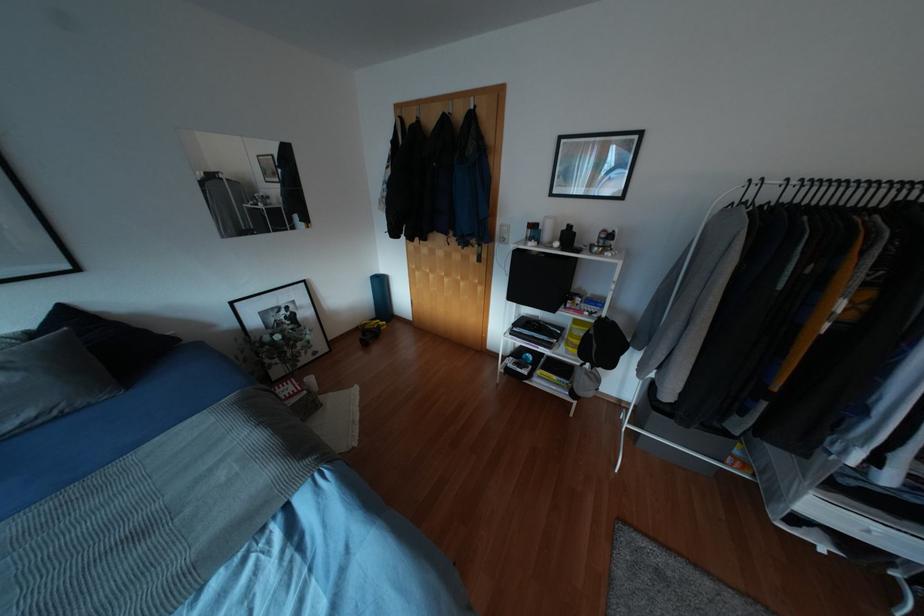
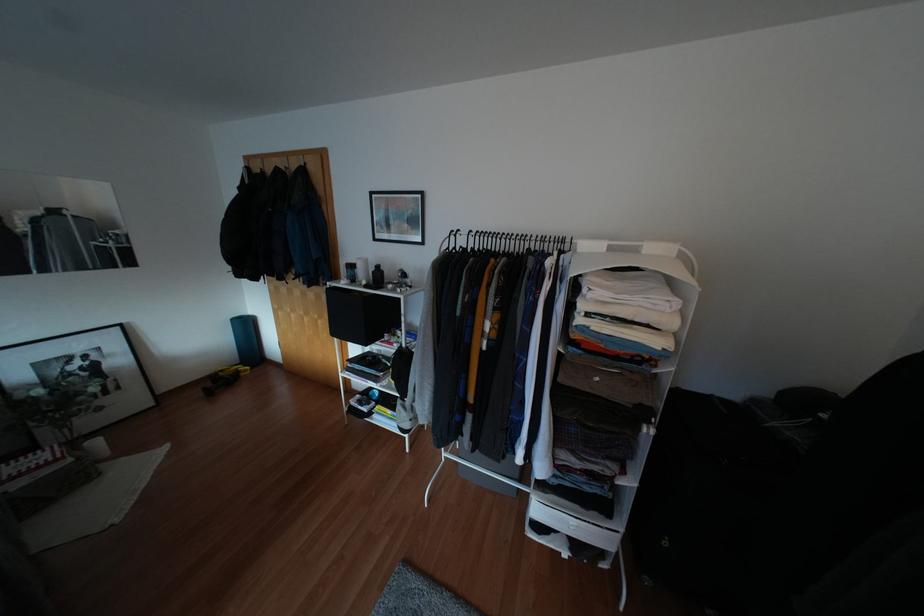
Where in the second image is the point corresponding to point 380,283 from the first image?

(246, 325)